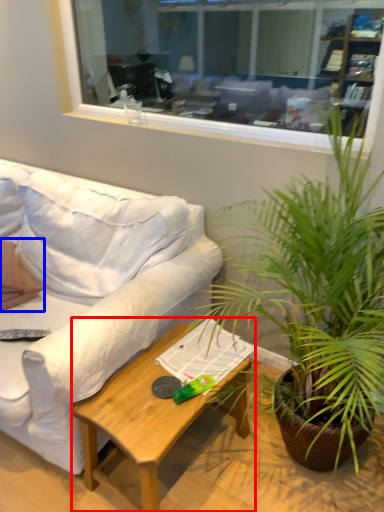
Question: Which point is closer to the camera, coffee table (highlighted by a red box) or pillow (highlighted by a blue box)?

Choices:
 (A) coffee table
 (B) pillow

Answer: (A)